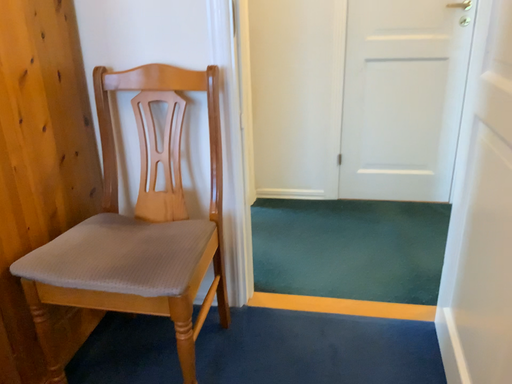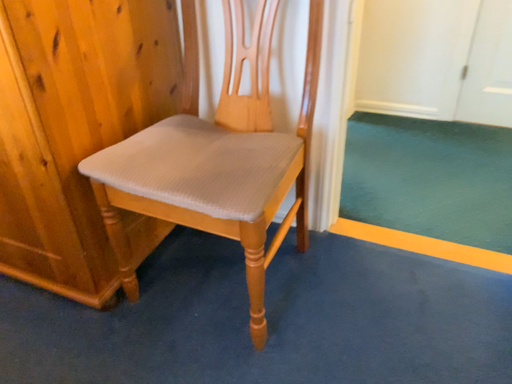
Question: How did the camera likely rotate when shooting the video?

Choices:
 (A) rotated downward
 (B) rotated upward

Answer: (A)